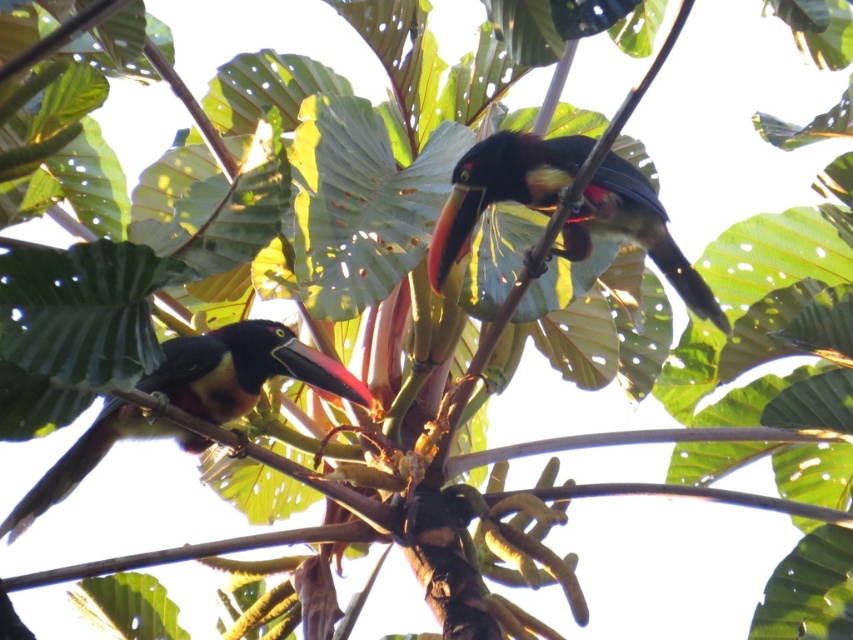
Question: In this image, where is shiny black toucan at center located relative to shiny black toucan at left?

Choices:
 (A) above
 (B) below

Answer: (A)

Question: Can you confirm if shiny black toucan at center is bigger than shiny black toucan at left?

Choices:
 (A) no
 (B) yes

Answer: (A)

Question: Among these objects, which one is nearest to the camera?

Choices:
 (A) shiny black toucan at left
 (B) shiny black toucan at center

Answer: (A)

Question: Can you confirm if shiny black toucan at center is positioned to the right of shiny black toucan at left?

Choices:
 (A) no
 (B) yes

Answer: (B)

Question: Among these objects, which one is nearest to the camera?

Choices:
 (A) shiny black toucan at center
 (B) shiny black toucan at left

Answer: (B)